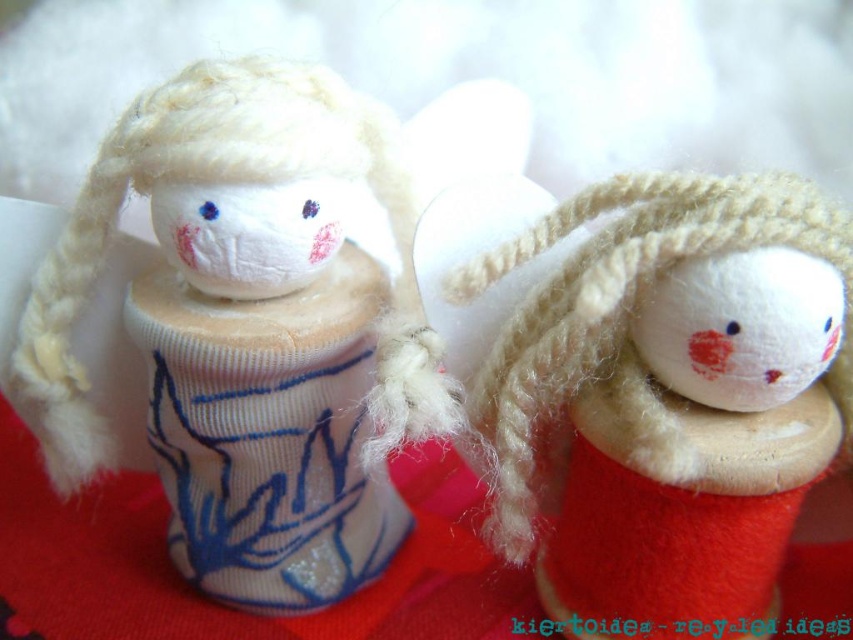
Question: Is white felt snowman at center thinner than red felt doll at center?

Choices:
 (A) no
 (B) yes

Answer: (A)

Question: Among these points, which one is farthest from the camera?

Choices:
 (A) (732, 240)
 (B) (262, 433)

Answer: (B)

Question: Can you confirm if white felt snowman at center is thinner than red felt doll at center?

Choices:
 (A) yes
 (B) no

Answer: (B)

Question: Can you confirm if white felt snowman at center is positioned to the left of red felt doll at center?

Choices:
 (A) no
 (B) yes

Answer: (B)